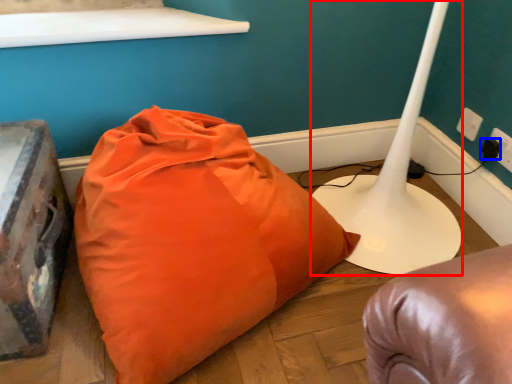
Question: Among these objects, which one is farthest to the camera, table lamp (highlighted by a red box) or plug (highlighted by a blue box)?

Choices:
 (A) table lamp
 (B) plug

Answer: (B)